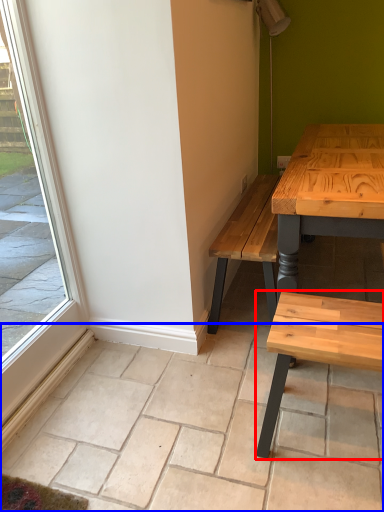
Question: Which object appears closest to the camera in this image, coffee table (highlighted by a red box) or tile (highlighted by a blue box)?

Choices:
 (A) coffee table
 (B) tile

Answer: (B)